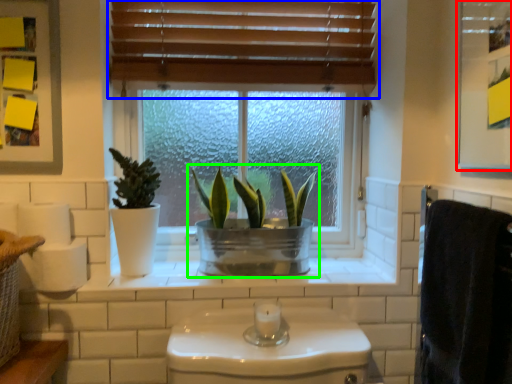
Question: Considering the real-world distances, which object is closest to medicine cabinet (highlighted by a red box)? window blind (highlighted by a blue box) or houseplant (highlighted by a green box).

Choices:
 (A) window blind
 (B) houseplant

Answer: (A)